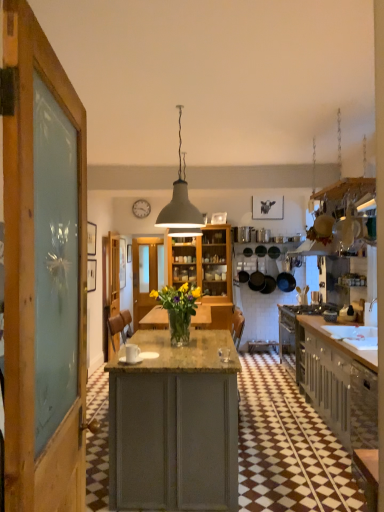
Question: Does matte gray cabinets at right come behind white matte pendant light at center?

Choices:
 (A) no
 (B) yes

Answer: (B)

Question: Considering the relative positions of matte gray cabinets at right and white matte pendant light at center in the image provided, is matte gray cabinets at right to the right of white matte pendant light at center from the viewer's perspective?

Choices:
 (A) no
 (B) yes

Answer: (B)

Question: Is matte gray cabinets at right located outside white matte pendant light at center?

Choices:
 (A) no
 (B) yes

Answer: (B)

Question: Does matte gray cabinets at right turn towards white matte pendant light at center?

Choices:
 (A) no
 (B) yes

Answer: (A)

Question: Is matte gray cabinets at right smaller than white matte pendant light at center?

Choices:
 (A) no
 (B) yes

Answer: (A)

Question: From a real-world perspective, is matte gray cabinets at right over white matte pendant light at center?

Choices:
 (A) yes
 (B) no

Answer: (B)

Question: Is wooden door at center at the back of matte gray cabinets at right?

Choices:
 (A) no
 (B) yes

Answer: (A)

Question: Considering the relative sizes of matte gray cabinets at right and wooden door at center in the image provided, is matte gray cabinets at right bigger than wooden door at center?

Choices:
 (A) yes
 (B) no

Answer: (A)

Question: From the image's perspective, is matte gray cabinets at right on top of wooden door at center?

Choices:
 (A) yes
 (B) no

Answer: (B)

Question: From a real-world perspective, is matte gray cabinets at right below wooden door at center?

Choices:
 (A) yes
 (B) no

Answer: (A)

Question: Is matte gray cabinets at right wider than wooden door at center?

Choices:
 (A) yes
 (B) no

Answer: (A)

Question: Is matte gray cabinets at right aimed at wooden door at center?

Choices:
 (A) yes
 (B) no

Answer: (B)

Question: Is translucent glass vase at center taller than matte gray cabinets at right?

Choices:
 (A) no
 (B) yes

Answer: (A)